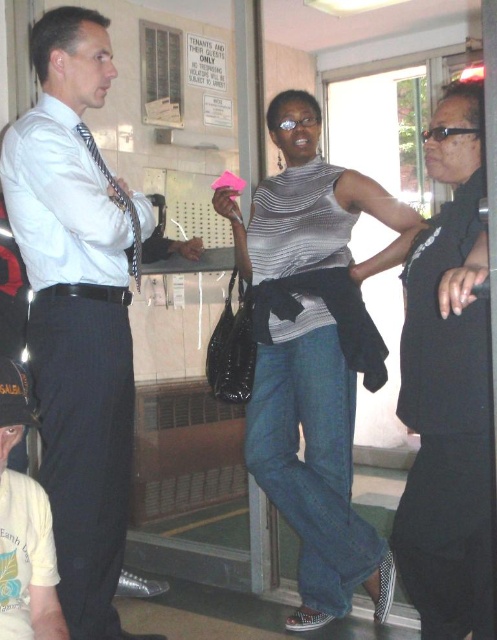
Between striped jersey at center and white cotton t-shirt at lower left, which one has more height?

striped jersey at center is taller.

Does striped jersey at center lie in front of white cotton t-shirt at lower left?

No.

Does point (340, 476) lie behind point (6, 474)?

Yes, it is behind point (6, 474).

In order to click on striped jersey at center in this screenshot , I will do `click(315, 355)`.

Consider the image. Measure the distance between point (98, 29) and camera.

They are 1.92 meters apart.

Between matte white shirt at center and black matte vest at right, which one has more height?

With more height is matte white shirt at center.

This screenshot has width=497, height=640. What are the coordinates of `matte white shirt at center` in the screenshot? It's located at (76, 314).

Image resolution: width=497 pixels, height=640 pixels. In order to click on black matte vest at right in this screenshot , I will do `click(447, 394)`.

Between black matte vest at right and white cotton t-shirt at lower left, which one has less height?

white cotton t-shirt at lower left is shorter.

Between point (477, 563) and point (22, 508), which one is positioned behind?

Positioned behind is point (477, 563).

Find the location of `black matte vest at right`. black matte vest at right is located at coordinates (447, 394).